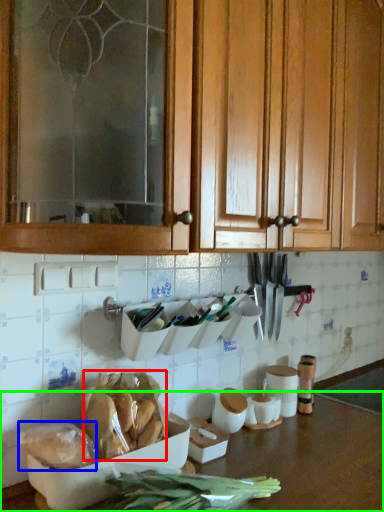
Question: Which object is positioned closest to food (highlighted by a red box)? Select from food (highlighted by a blue box) and countertop (highlighted by a green box).

Choices:
 (A) food
 (B) countertop

Answer: (A)